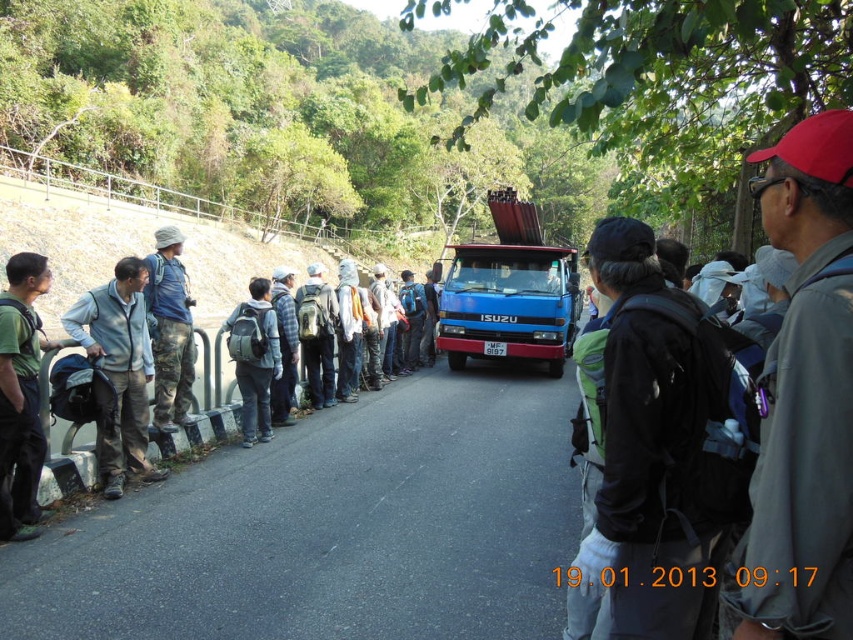
Question: Among these points, which one is farthest from the camera?

Choices:
 (A) (808, 557)
 (B) (641, 545)
 (C) (251, 365)

Answer: (C)

Question: Which is nearer to the black backpack at center?

Choices:
 (A) camouflage pants at center
 (B) blue metallic truck at center

Answer: (A)

Question: Is black backpack at center above light gray fleece jacket at left?

Choices:
 (A) yes
 (B) no

Answer: (A)

Question: Which point is closer to the camera?

Choices:
 (A) (622, 458)
 (B) (258, 308)
 (C) (177, 305)

Answer: (A)

Question: Does gray fabric jacket at right have a lesser width compared to camouflage pants at center?

Choices:
 (A) no
 (B) yes

Answer: (B)

Question: Is gray fabric jacket at right above blue metallic truck at center?

Choices:
 (A) yes
 (B) no

Answer: (B)